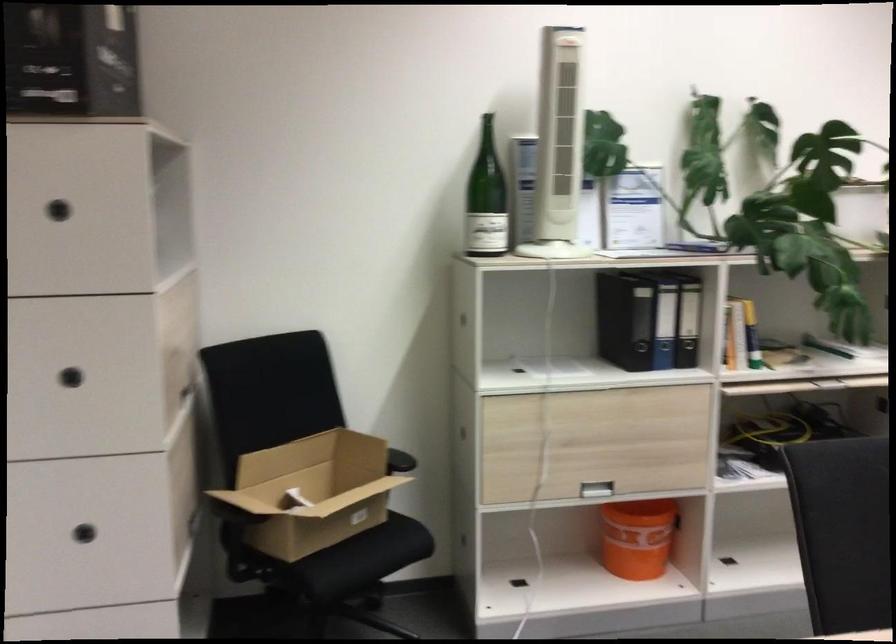
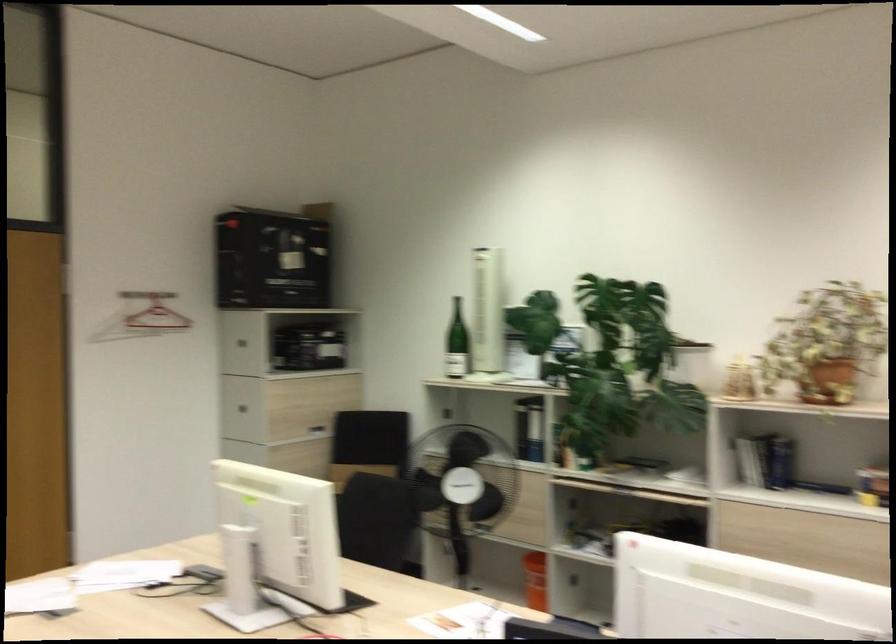
Where in the second image is the point corresponding to [113,375] from the first image?

(244, 402)